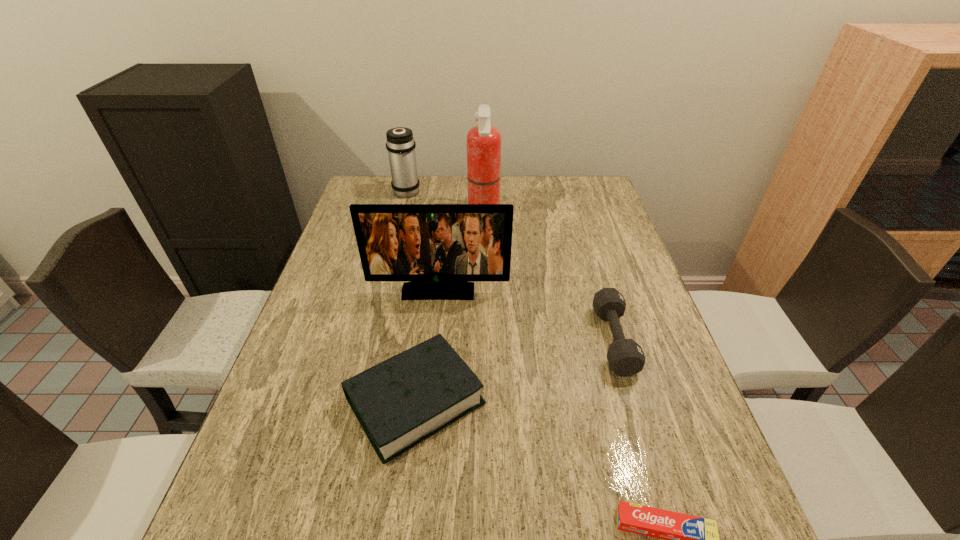
Where is `vacant space positioned 0.320m on the front of the dumbbell`? Image resolution: width=960 pixels, height=540 pixels. vacant space positioned 0.320m on the front of the dumbbell is located at coordinates (672, 535).

Where is `vacant space situated on the right of the Bible`? This screenshot has width=960, height=540. vacant space situated on the right of the Bible is located at coordinates (548, 401).

You are a GUI agent. You are given a task and a screenshot of the screen. Output one action in this format:
    pyautogui.click(x=<x>, y=<y>)
    Task: Click on the fire extinguisher located at the far edge
    
    Given the screenshot: What is the action you would take?
    pyautogui.click(x=483, y=141)

I want to click on thermos bottle situated at the far edge, so click(400, 144).

You are a GUI agent. You are given a task and a screenshot of the screen. Output one action in this format:
    pyautogui.click(x=<x>, y=<y>)
    Task: Click on the monitor situated at the left edge
    
    Given the screenshot: What is the action you would take?
    pyautogui.click(x=438, y=247)

Find the location of a particular element. Image resolution: width=960 pixels, height=540 pixels. thermos bottle present at the left edge is located at coordinates (400, 144).

This screenshot has height=540, width=960. In order to click on Bible that is at the left edge in this screenshot , I will do `click(402, 401)`.

You are a GUI agent. You are given a task and a screenshot of the screen. Output one action in this format:
    pyautogui.click(x=<x>, y=<y>)
    Task: Click on the object situated at the right edge
    The width and height of the screenshot is (960, 540).
    Given the screenshot: What is the action you would take?
    pyautogui.click(x=625, y=357)

The width and height of the screenshot is (960, 540). I want to click on object at the far left corner, so click(x=400, y=144).

Identify the location of blank space at the far edge of the desktop. (510, 179).